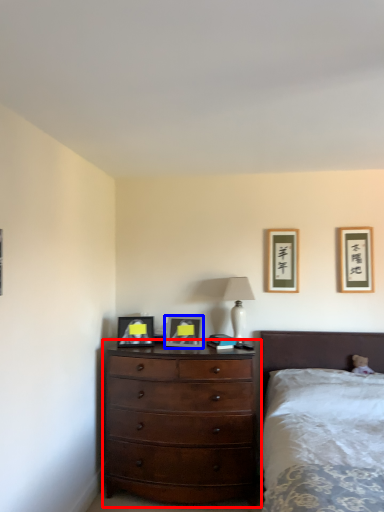
Question: Which object appears farthest to the camera in this image, chest of drawers (highlighted by a red box) or picture frame (highlighted by a blue box)?

Choices:
 (A) chest of drawers
 (B) picture frame

Answer: (B)